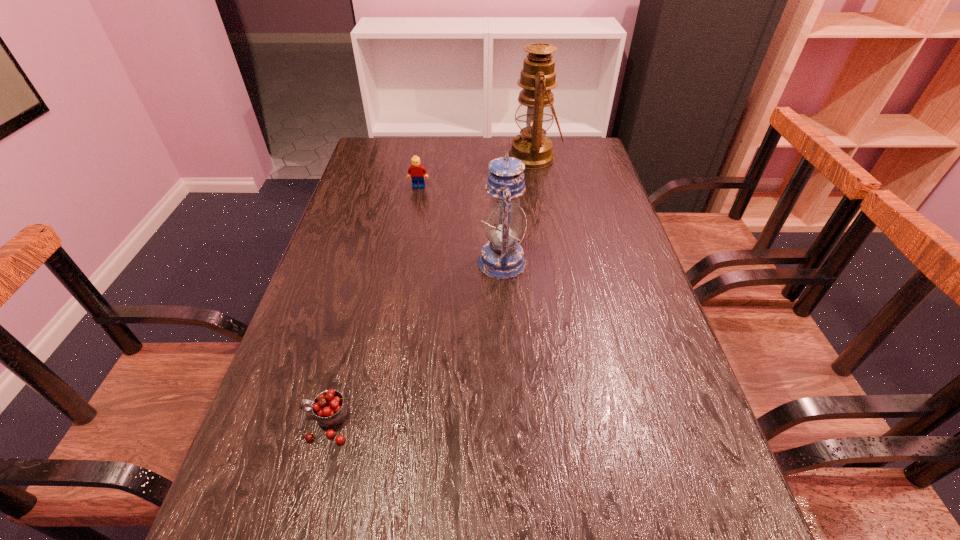
At what (x,y) coordinates should I click in order to perform the action: click on free space in the image that satisfies the following two spatial constraints: 1. on the front side of the oil lamp; 2. on the front-facing side of the lantern. Please return your answer as a coordinate pair (x, y). The image size is (960, 540). Looking at the image, I should click on (552, 262).

Where is `vacant space that satisfies the following two spatial constraints: 1. on the front side of the oil lamp; 2. on the front-facing side of the third farthest object`? The image size is (960, 540). vacant space that satisfies the following two spatial constraints: 1. on the front side of the oil lamp; 2. on the front-facing side of the third farthest object is located at coordinates (552, 262).